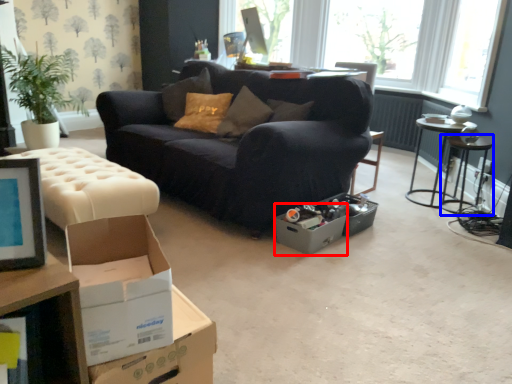
Question: Which object is further to the camera taking this photo, cardboard box (highlighted by a red box) or side table (highlighted by a blue box)?

Choices:
 (A) cardboard box
 (B) side table

Answer: (B)